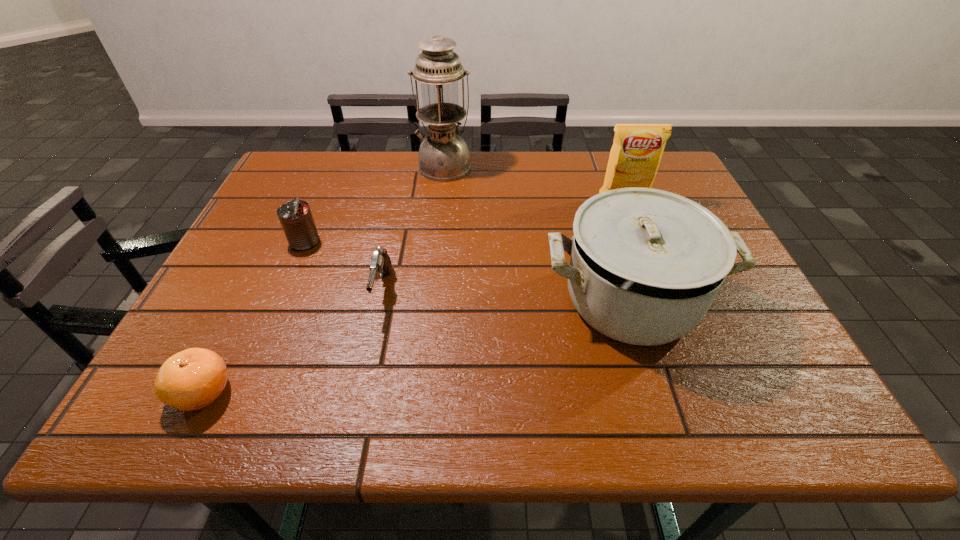
The image size is (960, 540). I want to click on crisp (potato chip) located at the right edge, so click(x=637, y=149).

The width and height of the screenshot is (960, 540). What are the coordinates of `saucepan situated at the right edge` in the screenshot? It's located at (646, 264).

In order to click on object that is at the near left corner in this screenshot , I will do `click(192, 379)`.

Locate an element on the screen. vacant area at the far edge of the desktop is located at coordinates (489, 163).

Identify the location of vacant position at the near edge of the desktop. The width and height of the screenshot is (960, 540). (256, 399).

This screenshot has width=960, height=540. In the image, there is a desktop. What are the coordinates of `vacant region at the left edge` in the screenshot? It's located at (202, 323).

Locate an element on the screen. The height and width of the screenshot is (540, 960). vacant area at the right edge of the desktop is located at coordinates (731, 312).

Locate an element on the screen. free space at the far left corner of the desktop is located at coordinates (317, 171).

Find the location of a particular element. free space at the far right corner of the desktop is located at coordinates (684, 179).

This screenshot has height=540, width=960. What are the coordinates of `free space at the near right corner of the desktop` in the screenshot? It's located at (799, 400).